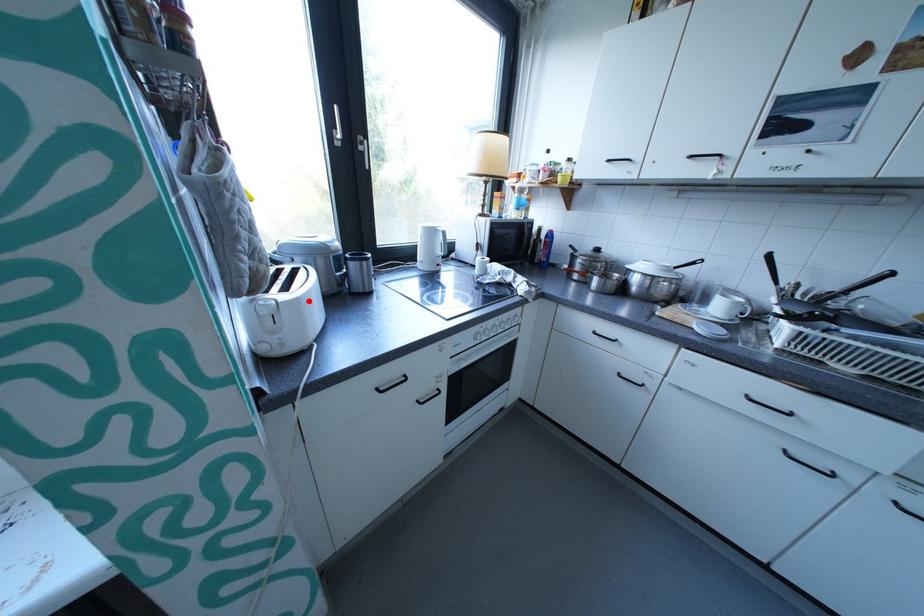
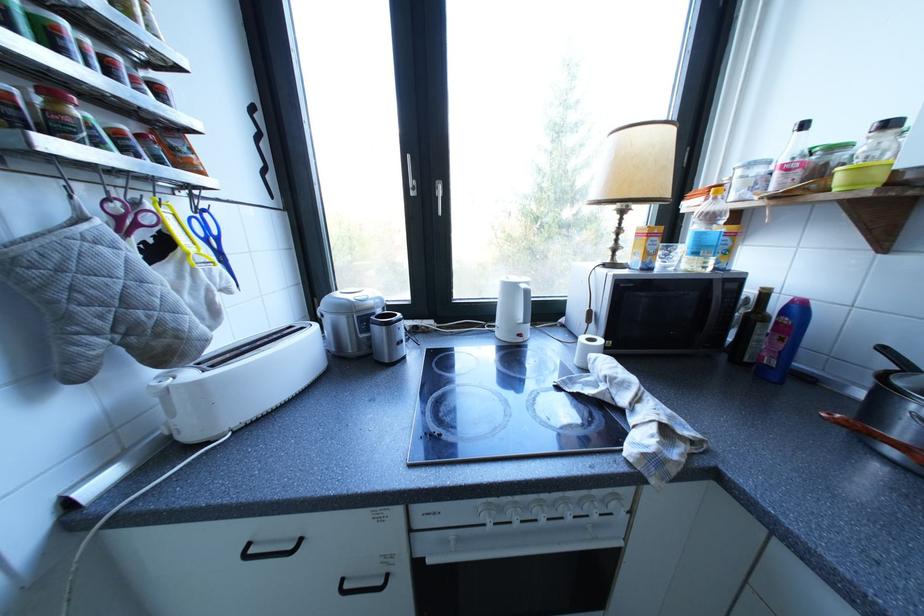
Where in the second image is the point corresponding to the highlighted location from the first image?

(210, 384)